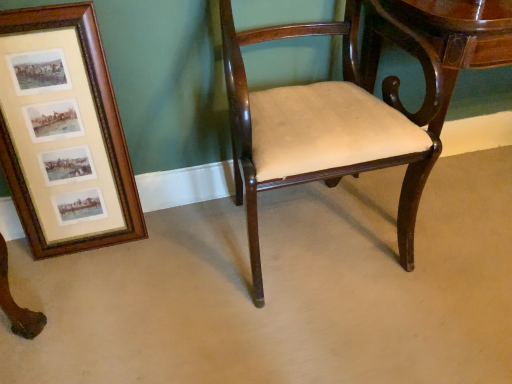
I want to click on vacant region to the left of mahogany wood chair at center, so click(168, 267).